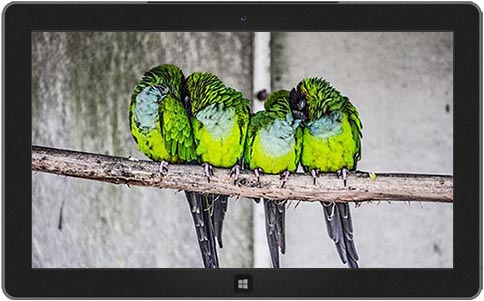
Locate an element on the screen. chest is located at coordinates (146, 94), (215, 115), (280, 130), (326, 118).